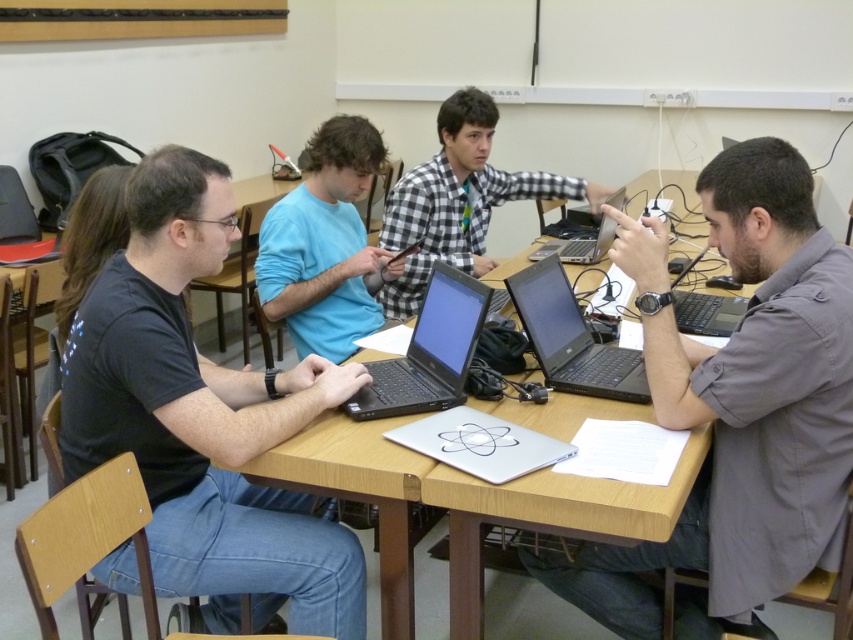
Measure the distance between gray matte shirt at right and camera.

The distance of gray matte shirt at right from camera is 1.48 meters.

Does point (827, 548) lie in front of point (97, 401)?

No, it is not.

Is point (735, 442) farther from viewer compared to point (268, 403)?

No, (735, 442) is in front of (268, 403).

The width and height of the screenshot is (853, 640). I want to click on gray matte shirt at right, so click(737, 406).

Does point (454, 145) come farther from viewer compared to point (461, 388)?

Yes, point (454, 145) is behind point (461, 388).

Is point (401, 196) positioned before point (460, 362)?

No, it is behind (460, 362).

You are a GUI agent. You are given a task and a screenshot of the screen. Output one action in this format:
    pyautogui.click(x=<x>, y=<y>)
    Task: Click on the checkered fabric shirt at center
    This screenshot has height=640, width=853.
    Given the screenshot: What is the action you would take?
    pyautogui.click(x=459, y=200)

Between point (724, 481) and point (393, 232), which one is positioned behind?

Positioned behind is point (393, 232).

Can you confirm if gray matte shirt at right is positioned below checkered fabric shirt at center?

Indeed, gray matte shirt at right is positioned under checkered fabric shirt at center.

Which is behind, point (654, 625) or point (421, 304)?

The point (421, 304) is behind.

The width and height of the screenshot is (853, 640). Identify the location of gray matte shirt at right. (737, 406).